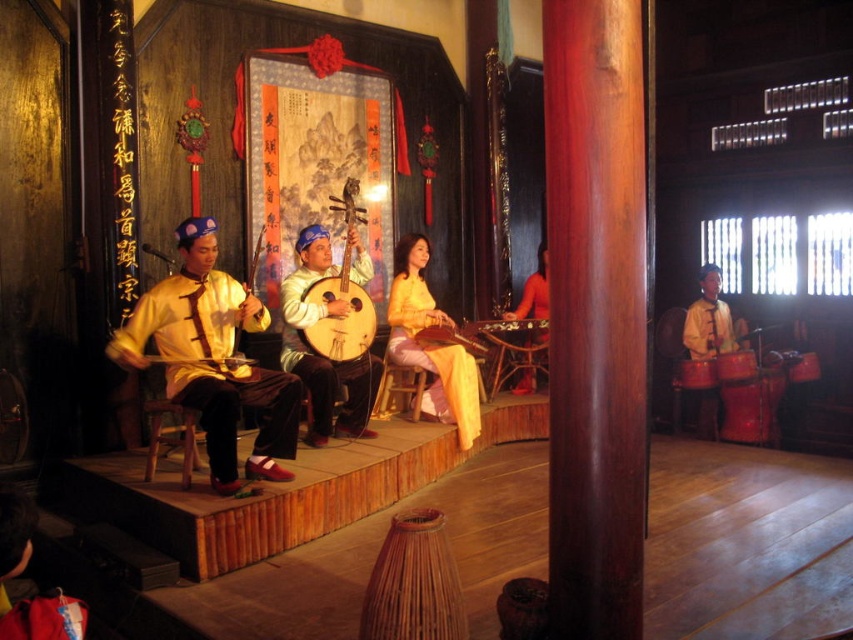
Question: Which point is closer to the camera?

Choices:
 (A) matte red dress at center
 (B) light brown wooden lute at center
 (C) matte yellow fabric at center

Answer: (C)

Question: Which point is closer to the camera?

Choices:
 (A) shiny red drum at right
 (B) wooden drum at center
 (C) matte red dress at center
 (D) light brown wooden lute at center

Answer: (D)

Question: Can you confirm if matte yellow fabric at center is positioned above matte yellow robe at center?

Choices:
 (A) no
 (B) yes

Answer: (A)

Question: Does yellow satin dress at center appear on the right side of wooden drum at center?

Choices:
 (A) no
 (B) yes

Answer: (A)

Question: Is matte yellow robe at center to the right of shiny red drum at right from the viewer's perspective?

Choices:
 (A) no
 (B) yes

Answer: (A)

Question: Which object is closer to the camera taking this photo?

Choices:
 (A) matte yellow robe at center
 (B) shiny red drum at right
 (C) light brown wooden lute at center

Answer: (A)